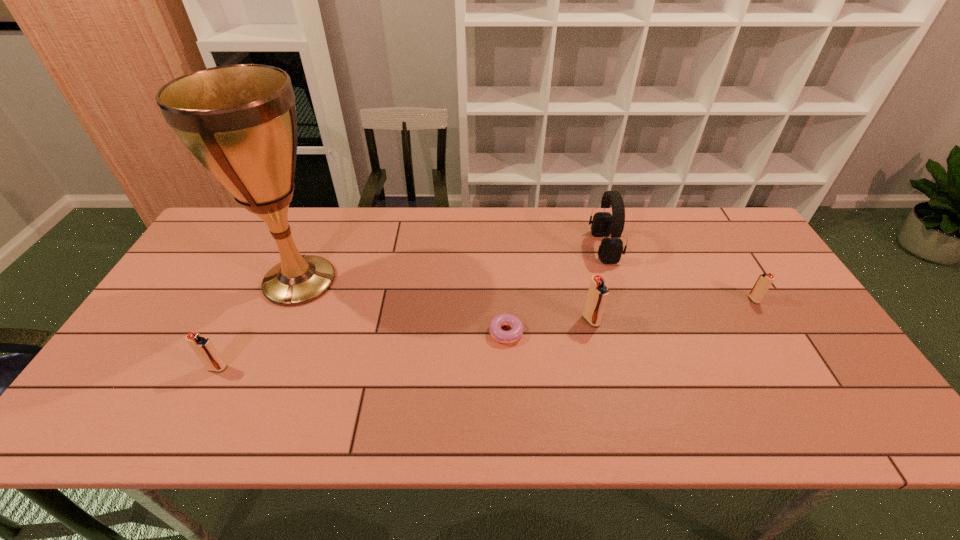
Identify the location of trophy cup at the far edge. This screenshot has width=960, height=540. (239, 121).

In order to click on object that is positioned at the near edge in this screenshot , I will do `click(202, 346)`.

The image size is (960, 540). In order to click on object that is at the right edge in this screenshot , I will do `click(764, 281)`.

The width and height of the screenshot is (960, 540). Find the location of `vacant area at the far edge`. vacant area at the far edge is located at coordinates (390, 240).

Identify the location of vacant area at the near edge of the desktop. (652, 378).

In the image, there is a desktop. At what (x,y) coordinates should I click in order to perform the action: click on free space at the left edge. Please return your answer as a coordinate pair (x, y). The height and width of the screenshot is (540, 960). Looking at the image, I should click on (179, 356).

Locate an element on the screen. This screenshot has height=540, width=960. vacant space at the far left corner of the desktop is located at coordinates (251, 225).

At what (x,y) coordinates should I click in order to perform the action: click on free region at the near left corner of the desktop. Please return your answer as a coordinate pair (x, y). Looking at the image, I should click on (130, 388).

Locate an element on the screen. The image size is (960, 540). vacant space at the far right corner of the desktop is located at coordinates (711, 212).

Locate an element on the screen. This screenshot has height=540, width=960. free area in between the shortest igniter and the fourth object from left to right is located at coordinates (672, 310).